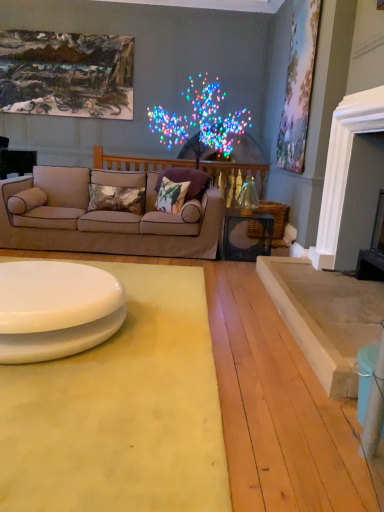
Question: Should I look upward or downward to see beige fabric couch at center?

Choices:
 (A) down
 (B) up

Answer: (B)

Question: From a real-world perspective, is yellow fabric mat at lower center below oil painting at upper left, which is counted as the 2th picture frame, starting from the right?

Choices:
 (A) yes
 (B) no

Answer: (A)

Question: Can we say yellow fabric mat at lower center lies outside oil painting at upper left, the first picture frame when ordered from back to front?

Choices:
 (A) no
 (B) yes

Answer: (B)

Question: Is yellow fabric mat at lower center aimed at oil painting at upper left, which ranks as the 2th picture frame in front-to-back order?

Choices:
 (A) yes
 (B) no

Answer: (B)

Question: Is yellow fabric mat at lower center not close to oil painting at upper left, which is counted as the 2th picture frame, starting from the right?

Choices:
 (A) yes
 (B) no

Answer: (A)

Question: Can you confirm if yellow fabric mat at lower center is smaller than oil painting at upper left, which is counted as the 2th picture frame, starting from the right?

Choices:
 (A) no
 (B) yes

Answer: (A)

Question: Is the depth of yellow fabric mat at lower center less than that of oil painting at upper left, the first picture frame when ordered from back to front?

Choices:
 (A) no
 (B) yes

Answer: (B)

Question: From a real-world perspective, is beige fabric couch at center on top of clear glass table at center, which appears as the 2th table when viewed from the front?

Choices:
 (A) yes
 (B) no

Answer: (A)

Question: Is beige fabric couch at center oriented away from clear glass table at center, placed as the first table when sorted from right to left?

Choices:
 (A) yes
 (B) no

Answer: (B)

Question: Is beige fabric couch at center outside of clear glass table at center, which appears as the second table when viewed from the left?

Choices:
 (A) yes
 (B) no

Answer: (A)

Question: Is beige fabric couch at center closer to camera compared to clear glass table at center, placed as the first table when sorted from right to left?

Choices:
 (A) no
 (B) yes

Answer: (B)

Question: Does beige fabric couch at center have a greater width compared to clear glass table at center, which appears as the 2th table when ordered from the bottom?

Choices:
 (A) yes
 (B) no

Answer: (A)

Question: Does beige fabric couch at center have a larger size compared to clear glass table at center, which appears as the second table when viewed from the left?

Choices:
 (A) yes
 (B) no

Answer: (A)

Question: Is the position of pastel floral canvas at upper right, which appears as the second picture frame when viewed from the left, more distant than that of beige fabric couch at center?

Choices:
 (A) yes
 (B) no

Answer: (A)